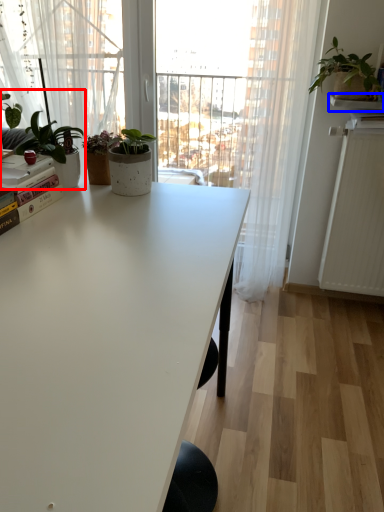
Question: Which object appears farthest to the camera in this image, houseplant (highlighted by a red box) or window sill (highlighted by a blue box)?

Choices:
 (A) houseplant
 (B) window sill

Answer: (B)